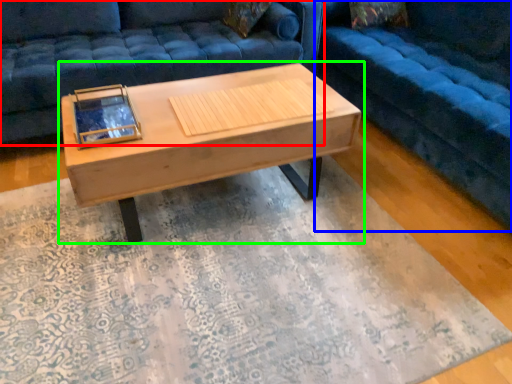
Question: Based on their relative distances, which object is nearer to studio couch (highlighted by a red box)? Choose from studio couch (highlighted by a blue box) and coffee table (highlighted by a green box).

Choices:
 (A) studio couch
 (B) coffee table

Answer: (B)